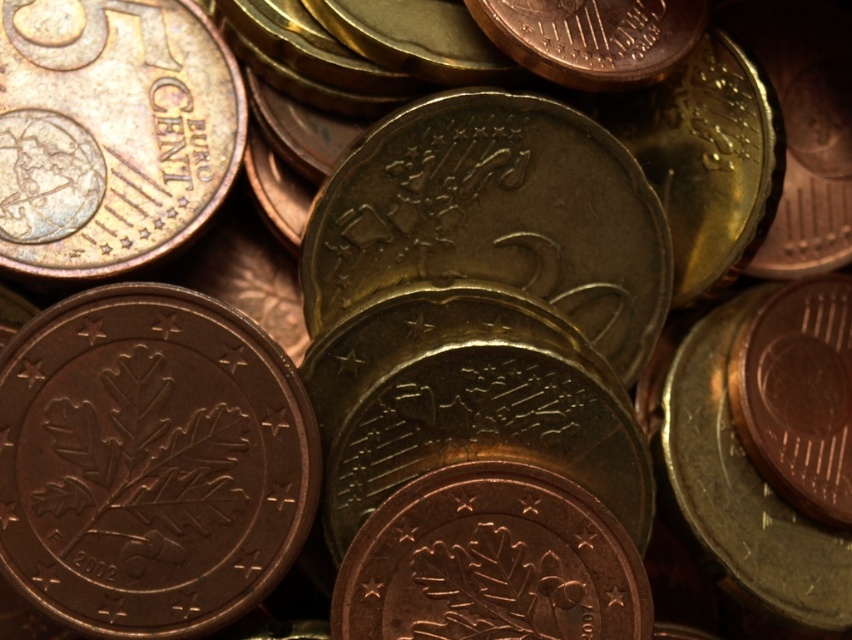
In the image of Euro coins, where is the bronze metallic coin at lower left in relation to the brass metallic coin at upper left?

The bronze metallic coin at lower left is positioned to the right of the brass metallic coin at upper left.

You are examining the coins and want to determine which point is nearer to you. Based on the image, which point is closer to you between the two points labeled point (55, 611) and point (133, 193)?

Point (55, 611) is closer to the viewer than point (133, 193).